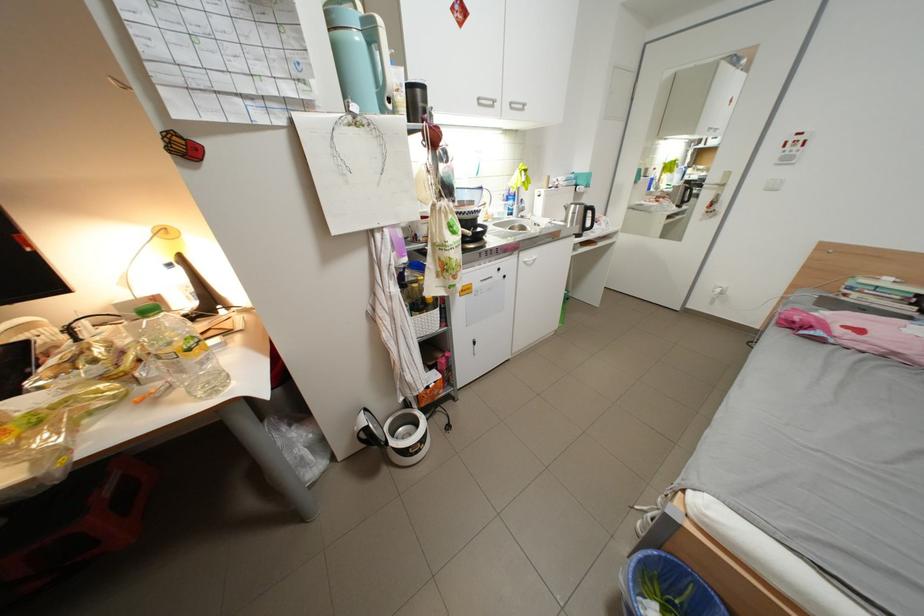
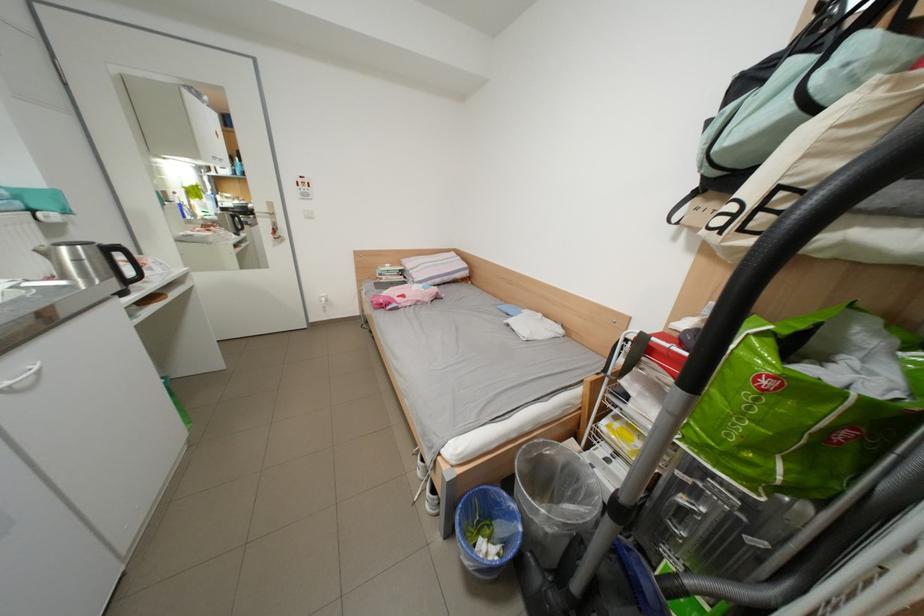
How did the camera likely rotate?

The camera's rotation is toward right-down.